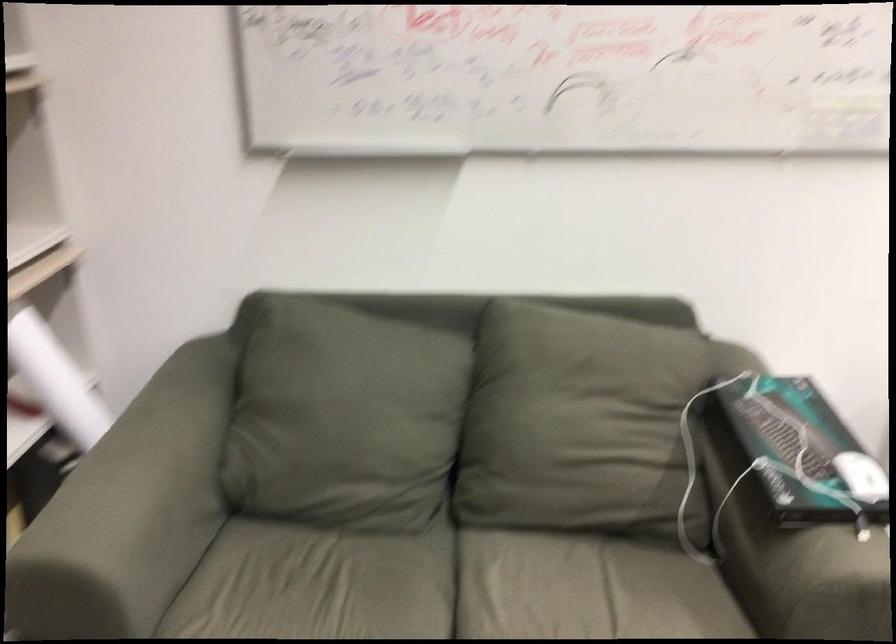
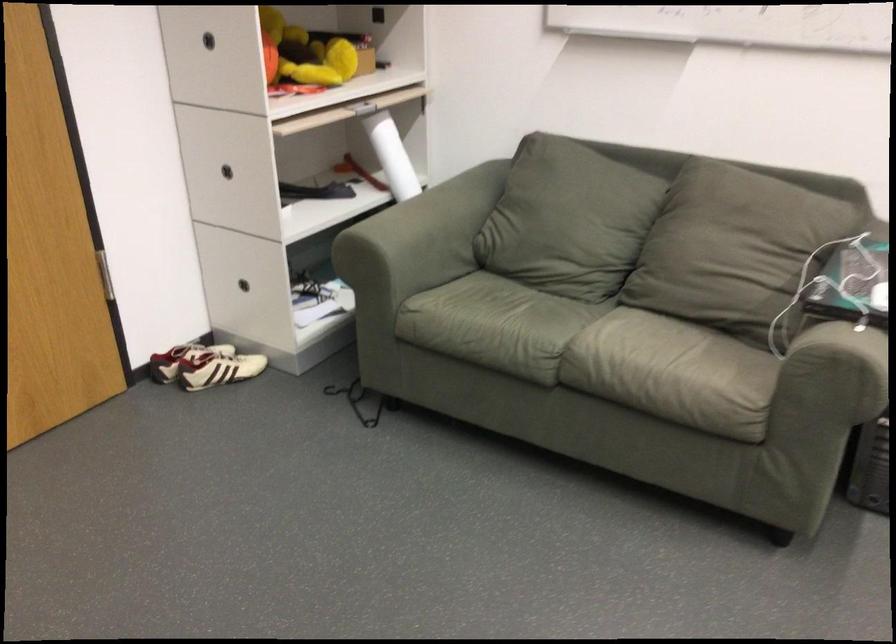
In the second image, find the point that corresponds to point 784,457 in the first image.

(851, 279)